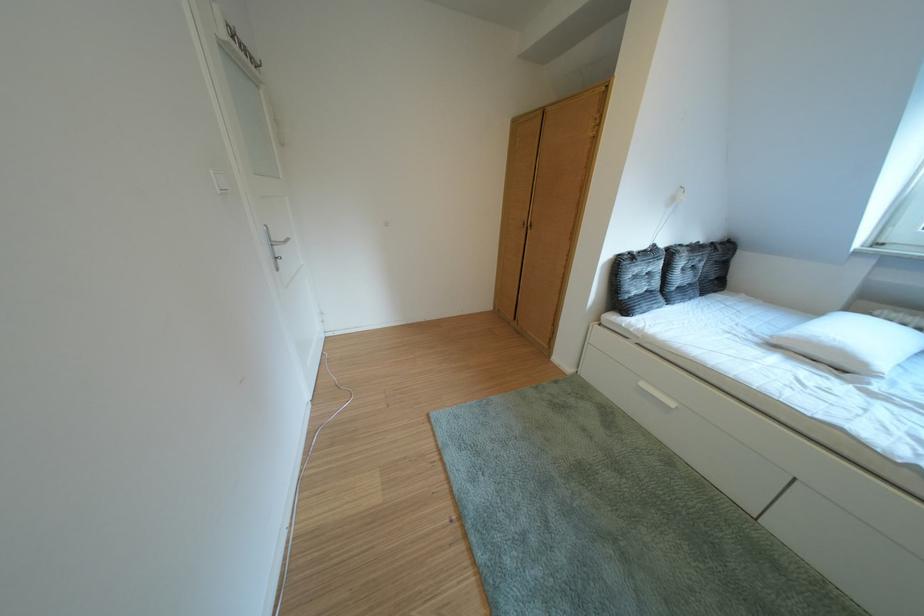
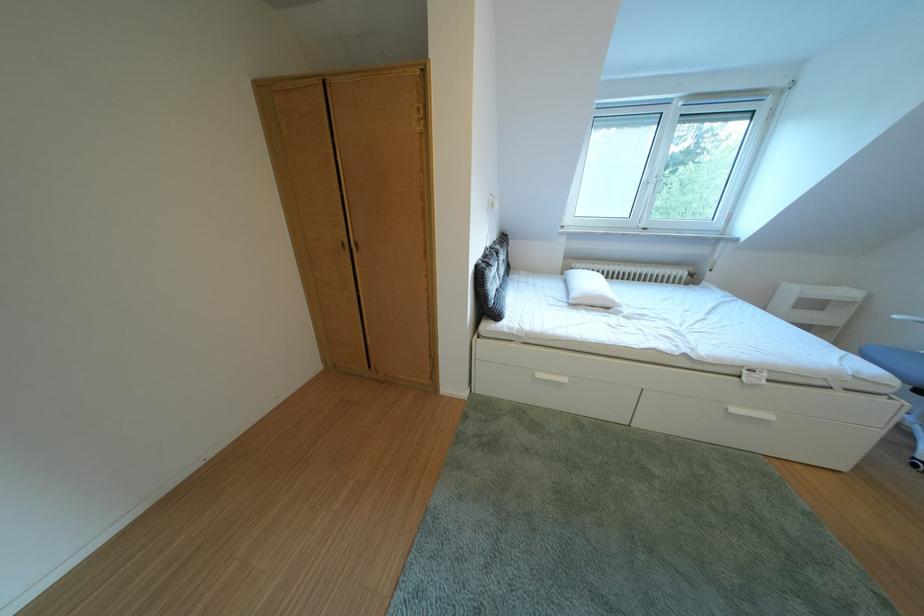
The point at (658,391) is marked in the first image. Where is the corresponding point in the second image?

(553, 381)